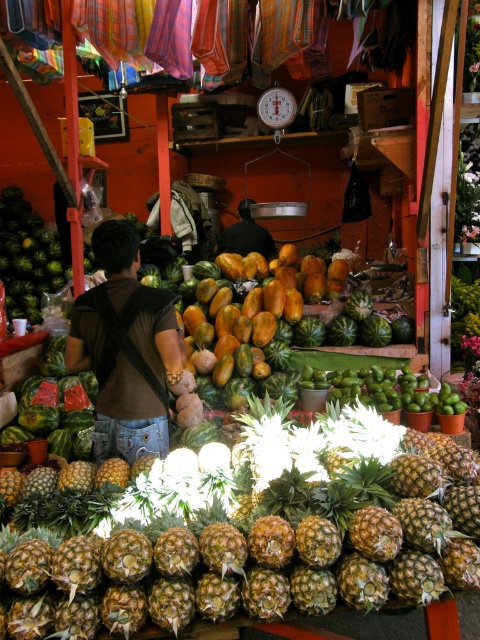
Question: Which of these objects is positioned farthest from the black fabric at center?

Choices:
 (A) green rough pineapple at center
 (B) brown leather backpack at center

Answer: (A)

Question: Among these objects, which one is farthest from the camera?

Choices:
 (A) brown leather backpack at center
 (B) green rough pineapple at center

Answer: (A)

Question: Can you confirm if brown leather backpack at center is wider than black fabric at center?

Choices:
 (A) no
 (B) yes

Answer: (A)

Question: Can you confirm if green rough pineapple at center is wider than black fabric at center?

Choices:
 (A) yes
 (B) no

Answer: (A)

Question: Considering the real-world distances, which object is farthest from the green rough pineapple at center?

Choices:
 (A) brown leather backpack at center
 (B) black fabric at center

Answer: (B)

Question: Does green rough pineapple at center lie in front of black fabric at center?

Choices:
 (A) yes
 (B) no

Answer: (A)